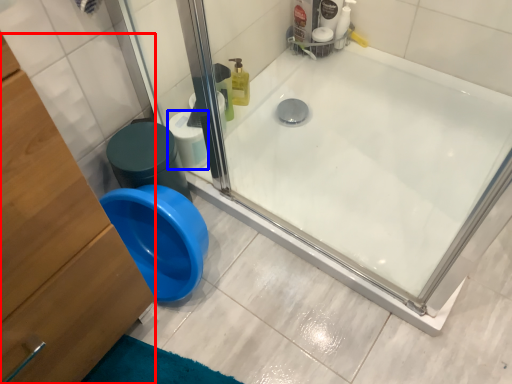
Question: Which object is further to the camera taking this photo, dresser (highlighted by a red box) or toilet paper (highlighted by a blue box)?

Choices:
 (A) dresser
 (B) toilet paper

Answer: (B)